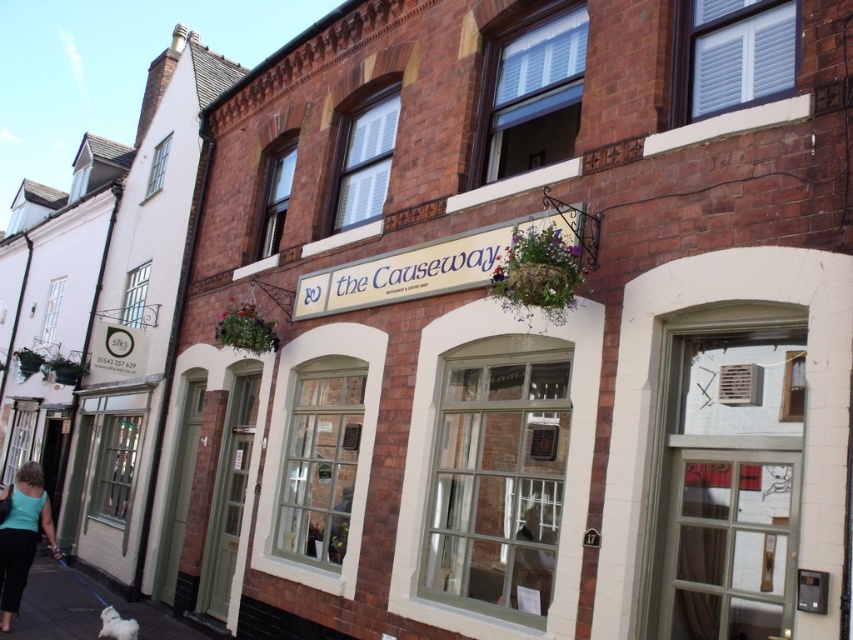
Question: Which point appears farthest from the camera in this image?

Choices:
 (A) (30, 588)
 (B) (103, 621)

Answer: (A)

Question: Can you confirm if black asphalt pavement at lower left is wider than teal fabric top at lower left?

Choices:
 (A) yes
 (B) no

Answer: (A)

Question: Does teal fabric top at lower left come behind white fluffy dog at lower left?

Choices:
 (A) yes
 (B) no

Answer: (A)

Question: Among these points, which one is nearest to the camera?

Choices:
 (A) (177, 634)
 (B) (119, 620)

Answer: (B)

Question: Which point is closer to the camera taking this photo?

Choices:
 (A) [x=55, y=628]
 (B) [x=3, y=628]

Answer: (B)

Question: Is teal fabric top at lower left positioned in front of white fluffy dog at lower left?

Choices:
 (A) yes
 (B) no

Answer: (B)